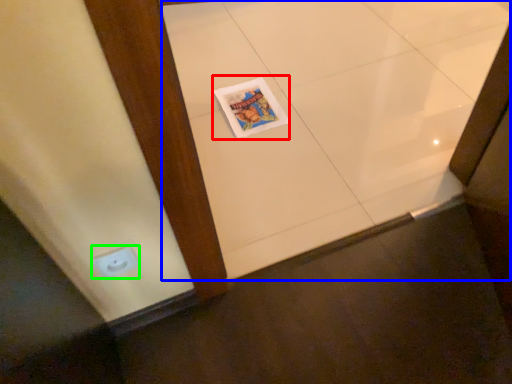
Question: Which is farther away from magazine (highlighted by a red box)? ceramic tile (highlighted by a blue box) or electric outlet (highlighted by a green box)?

Choices:
 (A) ceramic tile
 (B) electric outlet

Answer: (B)